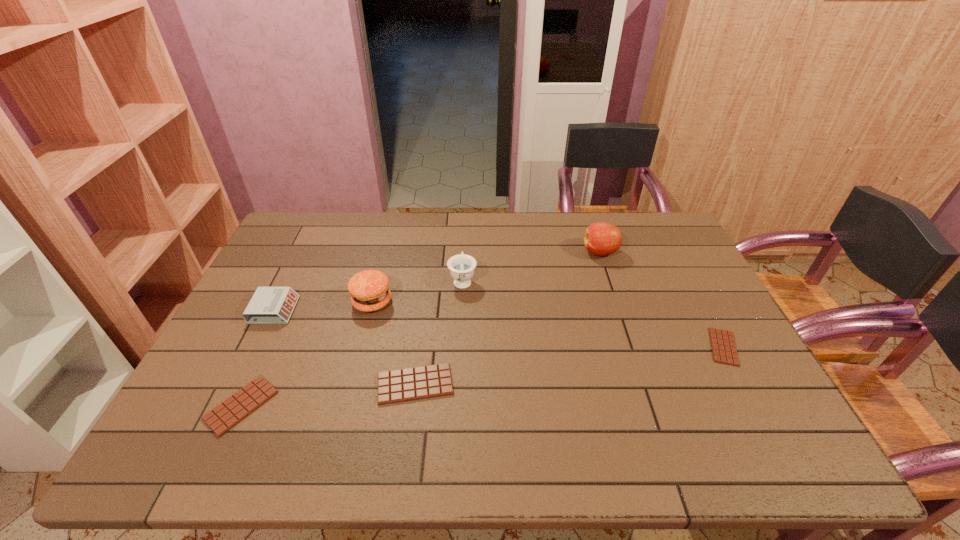
This screenshot has height=540, width=960. What are the coordinates of `free region at the far right corner of the desktop` in the screenshot? It's located at (640, 227).

What are the coordinates of `free spot between the alarm clock and the shortest candy bar` in the screenshot? It's located at [499, 328].

Where is `empty space that is in between the tallest object and the teacup`? Image resolution: width=960 pixels, height=540 pixels. empty space that is in between the tallest object and the teacup is located at coordinates (531, 266).

Find the location of `vacant region between the fourth shortest object and the tallest candy bar`. vacant region between the fourth shortest object and the tallest candy bar is located at coordinates (345, 347).

Where is `vacant space that is in between the fourth shortest object and the shortest object`? This screenshot has width=960, height=540. vacant space that is in between the fourth shortest object and the shortest object is located at coordinates (499, 328).

This screenshot has height=540, width=960. Identify the location of free space between the fourth shortest object and the tallest candy bar. (345, 347).

I want to click on vacant space that is in between the rightmost object and the second candy bar from right to left, so click(569, 366).

Locate an element on the screen. This screenshot has width=960, height=540. unoccupied position between the patty and the second candy bar from right to left is located at coordinates (394, 343).

What are the coordinates of `empty space that is in between the second candy bar from right to left and the patty` in the screenshot? It's located at (394, 343).

The height and width of the screenshot is (540, 960). Identify the location of free spot between the shortest candy bar and the alarm clock. (499, 328).